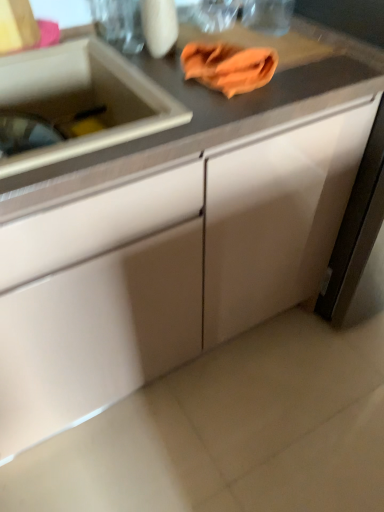
This screenshot has height=512, width=384. Find the location of `white matte cabinet at right, the first cabinetry when ordered from right to left`. white matte cabinet at right, the first cabinetry when ordered from right to left is located at coordinates (276, 219).

What do you see at coordinates (83, 99) in the screenshot? The image size is (384, 512). I see `white glossy sink at left` at bounding box center [83, 99].

Image resolution: width=384 pixels, height=512 pixels. I want to click on matte white cabinet at center, the first cabinetry positioned from the left, so click(165, 271).

At what (x,y) coordinates should I click in order to perform the action: click on orange cloth at upper center. Please return your answer as a coordinate pair (x, y). Looking at the image, I should click on (228, 66).

This screenshot has height=512, width=384. Find the location of `white matte cabinet at right, which is counted as the 2th cabinetry, starting from the left`. white matte cabinet at right, which is counted as the 2th cabinetry, starting from the left is located at coordinates (276, 219).

Which point is more distant from viewer, (100,57) or (246,69)?

The point (100,57) is farther from the camera.

From the picture: Which is more to the right, white glossy sink at left or orange cloth at upper center?

orange cloth at upper center is more to the right.

Is white glossy sink at left facing towards orange cloth at upper center?

No.

From the image's perspective, is orange cloth at upper center located above or below white glossy sink at left?

Based on their image positions, orange cloth at upper center is located above white glossy sink at left.

How many degrees apart are the facing directions of orange cloth at upper center and white glossy sink at left?

They differ by 0.0488 degrees in their facing directions.

Considering the relative sizes of orange cloth at upper center and white glossy sink at left in the image provided, is orange cloth at upper center bigger than white glossy sink at left?

No, orange cloth at upper center is not bigger than white glossy sink at left.

In terms of width, does white glossy sink at left look wider or thinner when compared to white matte cabinet at right, the first cabinetry when ordered from right to left?

Clearly, white glossy sink at left has less width compared to white matte cabinet at right, the first cabinetry when ordered from right to left.

Does white glossy sink at left come in front of white matte cabinet at right, the first cabinetry when ordered from right to left?

Yes, it is in front of white matte cabinet at right, the first cabinetry when ordered from right to left.

Considering the sizes of objects white glossy sink at left and white matte cabinet at right, which is counted as the 2th cabinetry, starting from the left, in the image provided, who is shorter, white glossy sink at left or white matte cabinet at right, which is counted as the 2th cabinetry, starting from the left,?

white glossy sink at left is shorter.

Is orange cloth at upper center thinner than matte white cabinet at center, the first cabinetry positioned from the left?

Yes, orange cloth at upper center is thinner than matte white cabinet at center, the first cabinetry positioned from the left.

Choose the correct answer: Is orange cloth at upper center inside matte white cabinet at center, the first cabinetry positioned from the left, or outside it?

orange cloth at upper center is spatially positioned inside matte white cabinet at center, the first cabinetry positioned from the left.

From a real-world perspective, count 2nd cabinetrys downward from the orange cloth at upper center and point to it. Please provide its 2D coordinates.

[(165, 271)]

Between orange cloth at upper center and matte white cabinet at center, the first cabinetry positioned from the left, which one is positioned behind?

orange cloth at upper center is further away from the camera.

How different are the orientations of matte white cabinet at center, positioned as the second cabinetry in right-to-left order, and white matte cabinet at right, which is counted as the 2th cabinetry, starting from the left, in degrees?

matte white cabinet at center, positioned as the second cabinetry in right-to-left order, and white matte cabinet at right, which is counted as the 2th cabinetry, starting from the left, are facing 0.000448 degrees away from each other.

From a real-world perspective, which is physically below, matte white cabinet at center, the first cabinetry positioned from the left, or white matte cabinet at right, which is counted as the 2th cabinetry, starting from the left?

In real-world perspective, matte white cabinet at center, the first cabinetry positioned from the left, is lower.

Would you say matte white cabinet at center, positioned as the second cabinetry in right-to-left order, contains white matte cabinet at right, the first cabinetry when ordered from right to left?

Definitely not — white matte cabinet at right, the first cabinetry when ordered from right to left, is not inside matte white cabinet at center, positioned as the second cabinetry in right-to-left order.

From a real-world perspective, who is located lower, orange cloth at upper center or white matte cabinet at right, which is counted as the 2th cabinetry, starting from the left?

In real-world perspective, white matte cabinet at right, which is counted as the 2th cabinetry, starting from the left, is lower.

Is point (225, 68) positioned in front of point (296, 194)?

Yes, point (225, 68) is closer to viewer.

Consider the image. Between orange cloth at upper center and white matte cabinet at right, the first cabinetry when ordered from right to left, which one has larger width?

Wider between the two is white matte cabinet at right, the first cabinetry when ordered from right to left.

Can matte white cabinet at center, the first cabinetry positioned from the left, be found inside white glossy sink at left?

Actually, matte white cabinet at center, the first cabinetry positioned from the left, is outside white glossy sink at left.

From a real-world perspective, which object rests below the other?

matte white cabinet at center, the first cabinetry positioned from the left, from a real-world perspective.

Does point (137, 108) come closer to viewer compared to point (241, 323)?

Yes, point (137, 108) is in front of point (241, 323).

Measure the distance between white glossy sink at left and matte white cabinet at center, the first cabinetry positioned from the left.

white glossy sink at left and matte white cabinet at center, the first cabinetry positioned from the left, are 15.18 inches apart from each other.

This screenshot has width=384, height=512. Find the location of `hand towel that appears behind the white glossy sink at left`. hand towel that appears behind the white glossy sink at left is located at coordinates click(x=228, y=66).

I want to click on sink that appears on the left of orange cloth at upper center, so click(x=83, y=99).

When comparing their distances from orange cloth at upper center, does white glossy sink at left or white matte cabinet at right, the first cabinetry when ordered from right to left, seem further?

white matte cabinet at right, the first cabinetry when ordered from right to left, is further to orange cloth at upper center.

From the image, which object appears to be nearer to white glossy sink at left, orange cloth at upper center or matte white cabinet at center, positioned as the second cabinetry in right-to-left order?

Among the two, orange cloth at upper center is located nearer to white glossy sink at left.

Based on their spatial positions, is white glossy sink at left or matte white cabinet at center, positioned as the second cabinetry in right-to-left order, further from orange cloth at upper center?

matte white cabinet at center, positioned as the second cabinetry in right-to-left order, is positioned further to the anchor orange cloth at upper center.

Considering their positions, is white glossy sink at left positioned further to white matte cabinet at right, which is counted as the 2th cabinetry, starting from the left, than orange cloth at upper center?

white glossy sink at left is positioned further to the anchor white matte cabinet at right, which is counted as the 2th cabinetry, starting from the left.

From the image, which object appears to be nearer to matte white cabinet at center, the first cabinetry positioned from the left, white glossy sink at left or white matte cabinet at right, which is counted as the 2th cabinetry, starting from the left?

white matte cabinet at right, which is counted as the 2th cabinetry, starting from the left, is closer to matte white cabinet at center, the first cabinetry positioned from the left.

Looking at the image, which one is located closer to matte white cabinet at center, the first cabinetry positioned from the left, white glossy sink at left or orange cloth at upper center?

white glossy sink at left is positioned closer to the anchor matte white cabinet at center, the first cabinetry positioned from the left.

When comparing their distances from white matte cabinet at right, the first cabinetry when ordered from right to left, does orange cloth at upper center or matte white cabinet at center, the first cabinetry positioned from the left, seem closer?

matte white cabinet at center, the first cabinetry positioned from the left, is positioned closer to the anchor white matte cabinet at right, the first cabinetry when ordered from right to left.

Based on their spatial positions, is matte white cabinet at center, the first cabinetry positioned from the left, or white matte cabinet at right, the first cabinetry when ordered from right to left, closer to white glossy sink at left?

The object closer to white glossy sink at left is matte white cabinet at center, the first cabinetry positioned from the left.

Where is `cabinetry situated between white glossy sink at left and white matte cabinet at right, the first cabinetry when ordered from right to left, from left to right`? Image resolution: width=384 pixels, height=512 pixels. cabinetry situated between white glossy sink at left and white matte cabinet at right, the first cabinetry when ordered from right to left, from left to right is located at coordinates tap(165, 271).

Where is `hand towel between matte white cabinet at center, the first cabinetry positioned from the left, and white matte cabinet at right, which is counted as the 2th cabinetry, starting from the left, from left to right`? hand towel between matte white cabinet at center, the first cabinetry positioned from the left, and white matte cabinet at right, which is counted as the 2th cabinetry, starting from the left, from left to right is located at coordinates (228, 66).

Image resolution: width=384 pixels, height=512 pixels. Identify the location of cabinetry situated between white glossy sink at left and orange cloth at upper center from left to right. (165, 271).

Where is `hand towel between white glossy sink at left and white matte cabinet at right, which is counted as the 2th cabinetry, starting from the left, in the horizontal direction`? The image size is (384, 512). hand towel between white glossy sink at left and white matte cabinet at right, which is counted as the 2th cabinetry, starting from the left, in the horizontal direction is located at coordinates (228, 66).